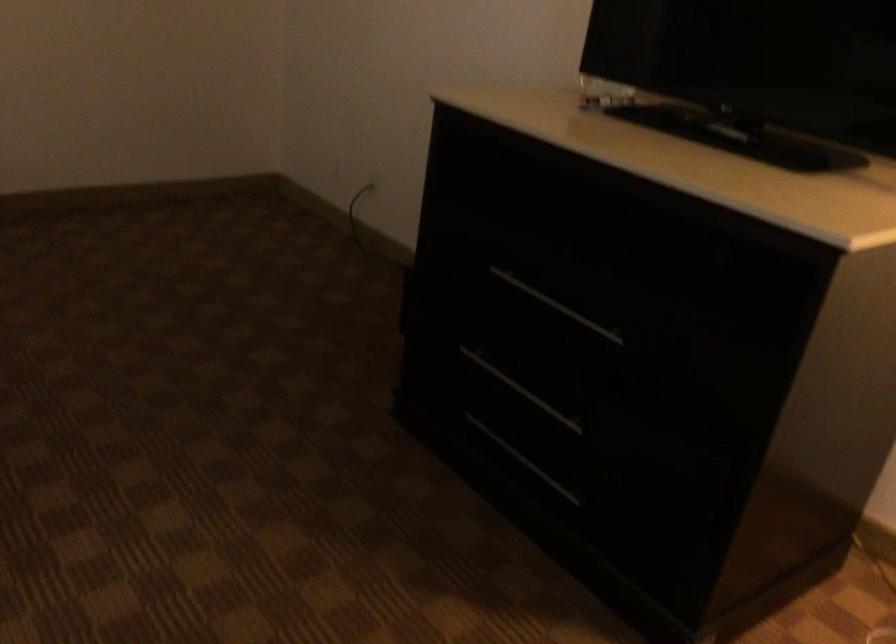
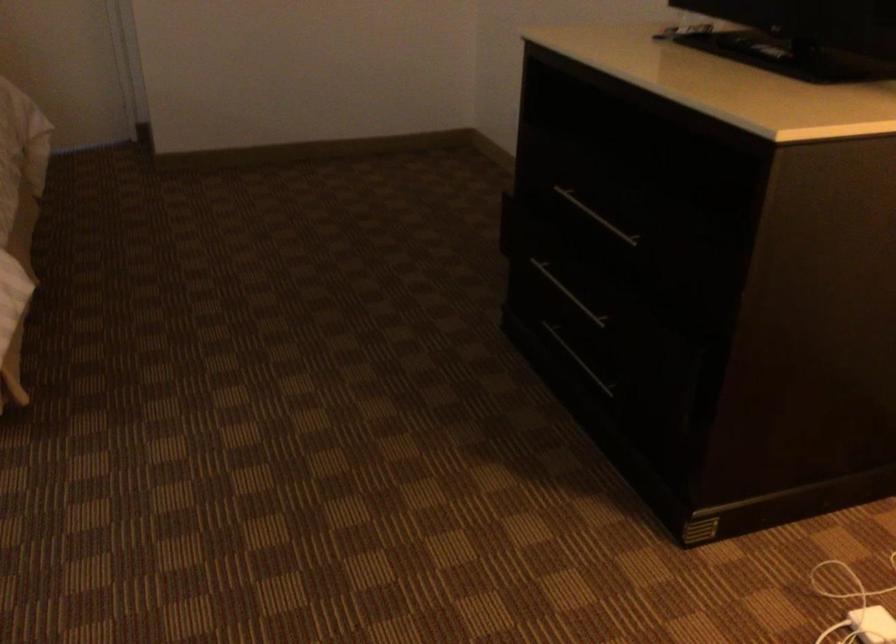
Locate, in the second image, the point that corresponds to point (521, 462) in the first image.

(579, 360)